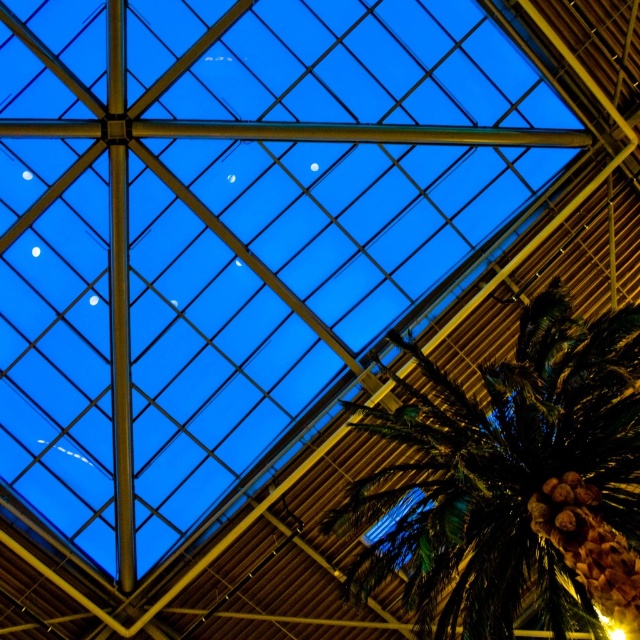
Question: Can you confirm if green leafy palm tree at lower right is positioned below metallic beam at center?

Choices:
 (A) yes
 (B) no

Answer: (A)

Question: Which point is farther to the camera?

Choices:
 (A) metallic beam at center
 (B) green leafy palm tree at lower right

Answer: (A)

Question: Can you confirm if brown matte pine cone at lower right is wider than metallic beam at center?

Choices:
 (A) yes
 (B) no

Answer: (B)

Question: Can you confirm if green leafy palm tree at lower right is wider than brown matte pine cone at lower right?

Choices:
 (A) no
 (B) yes

Answer: (B)

Question: Which point is closer to the camera?

Choices:
 (A) (483, 132)
 (B) (636, 557)
 (C) (509, 410)

Answer: (B)

Question: Among these points, which one is nearest to the camera?

Choices:
 (A) (557, 515)
 (B) (252, 138)

Answer: (A)